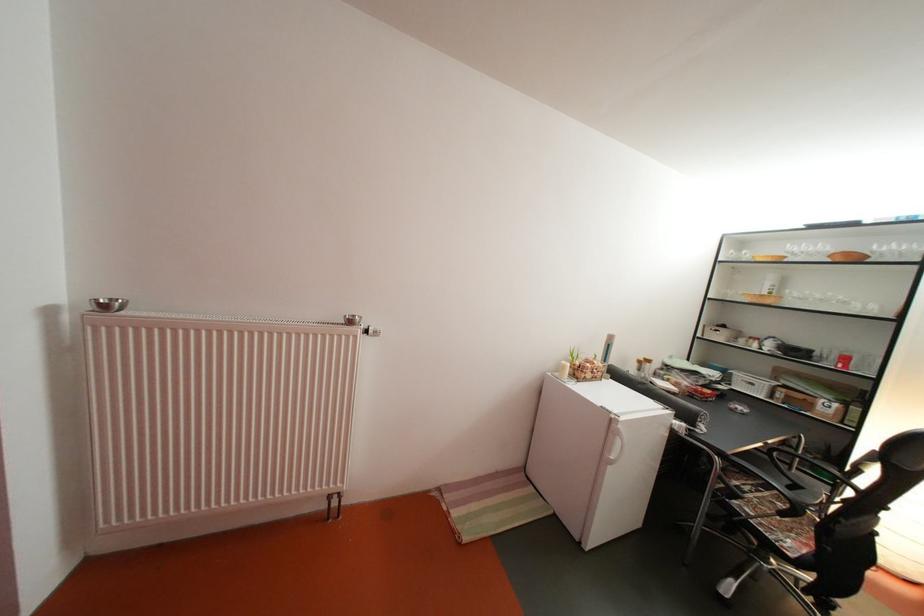
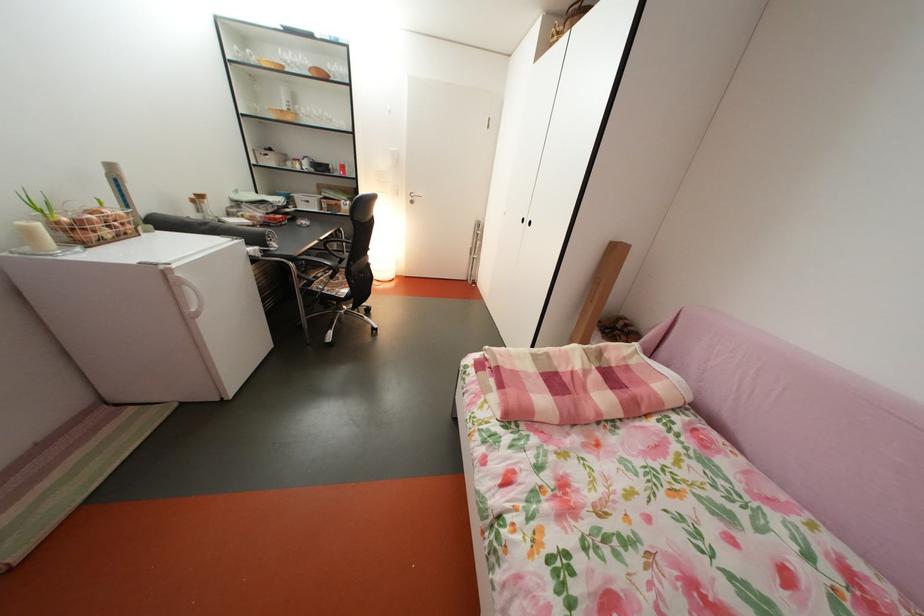
Where in the second image is the point corresponding to point (600, 382) from the first image?

(118, 238)